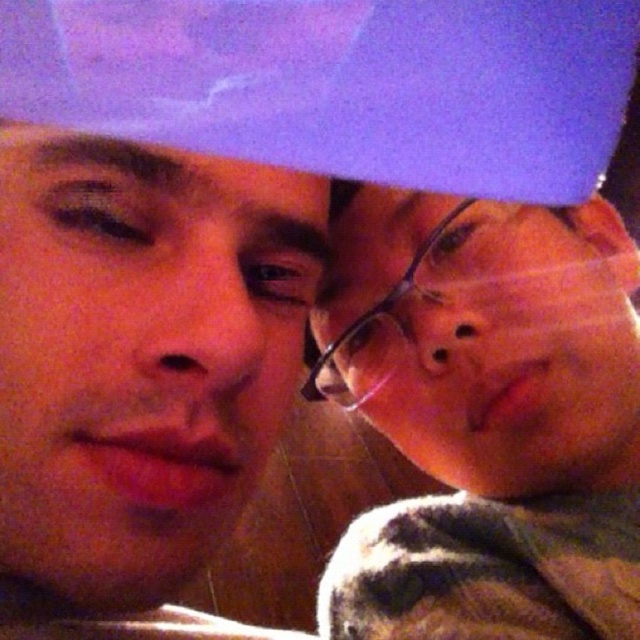
Question: Is matte black glasses at right closer to camera compared to smooth skin face at center?

Choices:
 (A) no
 (B) yes

Answer: (A)

Question: Is matte black glasses at right to the right of smooth skin face at center from the viewer's perspective?

Choices:
 (A) yes
 (B) no

Answer: (A)

Question: Which point is farther to the camera?

Choices:
 (A) matte black glasses at right
 (B) smooth skin face at center

Answer: (A)

Question: Can you confirm if matte black glasses at right is smaller than smooth skin face at center?

Choices:
 (A) no
 (B) yes

Answer: (A)